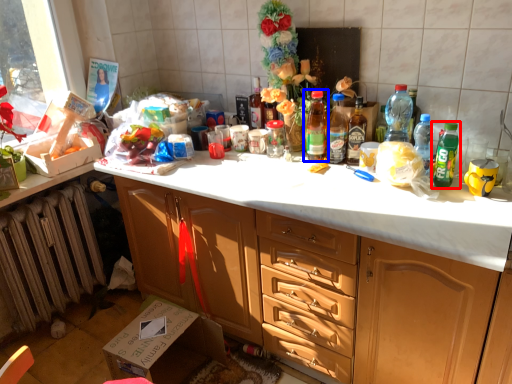
Question: Which of the following is the farthest to the observer, bottle (highlighted by a red box) or bottle (highlighted by a blue box)?

Choices:
 (A) bottle
 (B) bottle

Answer: (B)